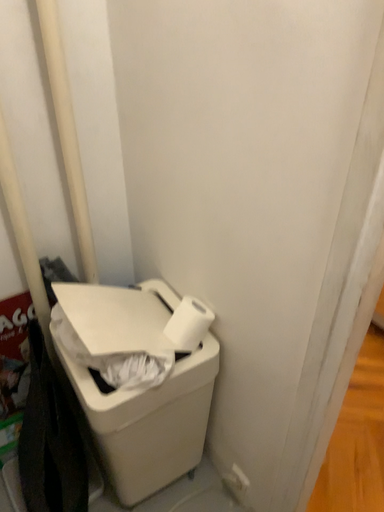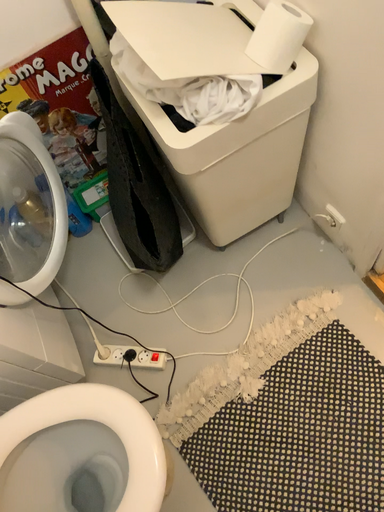
Question: Which way did the camera rotate in the video?

Choices:
 (A) rotated left
 (B) rotated right

Answer: (A)